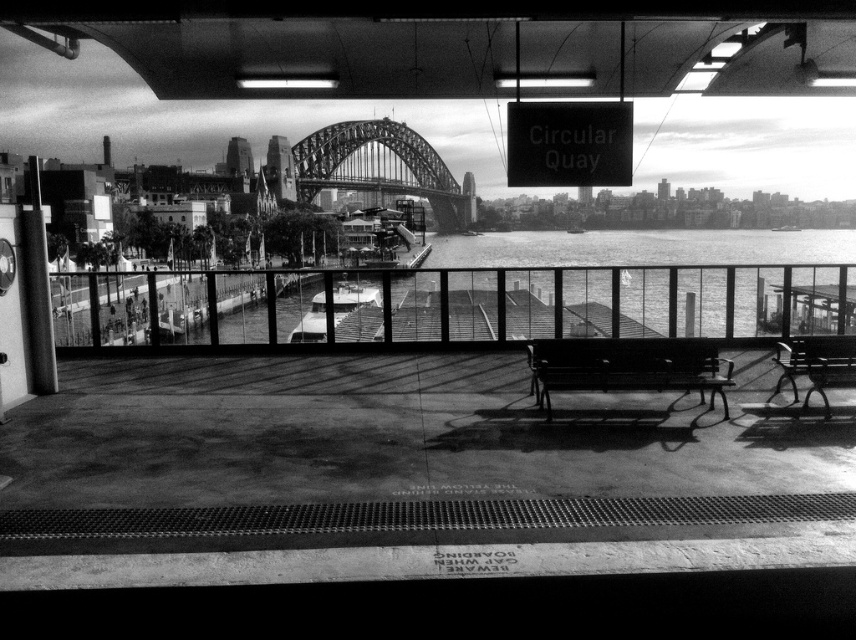
You are standing on the platform at Circular Quay train station and want to look at the smooth water at center through the glass railing. However, there is a metallic polished bench at right in your way. Which object should you move to get a clear view of the water?

You should move the metallic polished bench at right because the smooth water at center is closer to you than the bench, so moving the bench would allow an unobstructed view of the water.

You are standing on the train platform at Circular Quay and want to find the smooth water. According to the tactile paving strip on the dark floor, which direction should you walk to reach the smooth water at center?

The smooth water at center is located at point (x=625, y=284), so you should walk forward from the tactile paving strip towards the center of the platform to reach it.